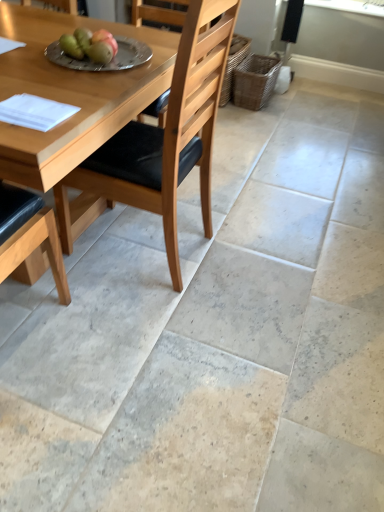
Question: From a real-world perspective, is green matte apple at upper left, the 1th fruit from the left, on green matte pears at upper center, the first fruit in the right-to-left sequence?

Choices:
 (A) no
 (B) yes

Answer: (A)

Question: Does green matte apple at upper left, acting as the 2th fruit starting from the right, come in front of green matte pears at upper center, the second fruit from the left?

Choices:
 (A) no
 (B) yes

Answer: (A)

Question: Considering the relative sizes of green matte apple at upper left, acting as the 2th fruit starting from the right, and green matte pears at upper center, the second fruit from the left, in the image provided, is green matte apple at upper left, acting as the 2th fruit starting from the right, smaller than green matte pears at upper center, the second fruit from the left,?

Choices:
 (A) yes
 (B) no

Answer: (B)

Question: Is green matte apple at upper left, the 1th fruit from the left, facing towards green matte pears at upper center, the second fruit from the left?

Choices:
 (A) no
 (B) yes

Answer: (A)

Question: Can you confirm if green matte apple at upper left, acting as the 2th fruit starting from the right, is positioned to the right of green matte pears at upper center, the first fruit in the right-to-left sequence?

Choices:
 (A) yes
 (B) no

Answer: (B)

Question: Considering the relative sizes of green matte apple at upper left, acting as the 2th fruit starting from the right, and green matte pears at upper center, the second fruit from the left, in the image provided, is green matte apple at upper left, acting as the 2th fruit starting from the right, taller than green matte pears at upper center, the second fruit from the left,?

Choices:
 (A) no
 (B) yes

Answer: (B)

Question: Is green matte pears at upper center, the first fruit in the right-to-left sequence, not near silver metallic plate at upper center?

Choices:
 (A) yes
 (B) no

Answer: (B)

Question: Considering the relative positions of green matte pears at upper center, the first fruit in the right-to-left sequence, and silver metallic plate at upper center in the image provided, is green matte pears at upper center, the first fruit in the right-to-left sequence, in front of silver metallic plate at upper center?

Choices:
 (A) yes
 (B) no

Answer: (A)

Question: Considering the relative positions of green matte pears at upper center, the first fruit in the right-to-left sequence, and silver metallic plate at upper center in the image provided, is green matte pears at upper center, the first fruit in the right-to-left sequence, to the right of silver metallic plate at upper center from the viewer's perspective?

Choices:
 (A) yes
 (B) no

Answer: (A)

Question: Does green matte pears at upper center, the first fruit in the right-to-left sequence, have a larger size compared to silver metallic plate at upper center?

Choices:
 (A) yes
 (B) no

Answer: (B)

Question: From a real-world perspective, is green matte pears at upper center, the first fruit in the right-to-left sequence, located beneath silver metallic plate at upper center?

Choices:
 (A) no
 (B) yes

Answer: (A)

Question: Is green matte pears at upper center, the first fruit in the right-to-left sequence, with silver metallic plate at upper center?

Choices:
 (A) yes
 (B) no

Answer: (A)

Question: Can you confirm if light brown wood chair at center is wider than green matte apple at upper left, the 1th fruit from the left?

Choices:
 (A) no
 (B) yes

Answer: (B)